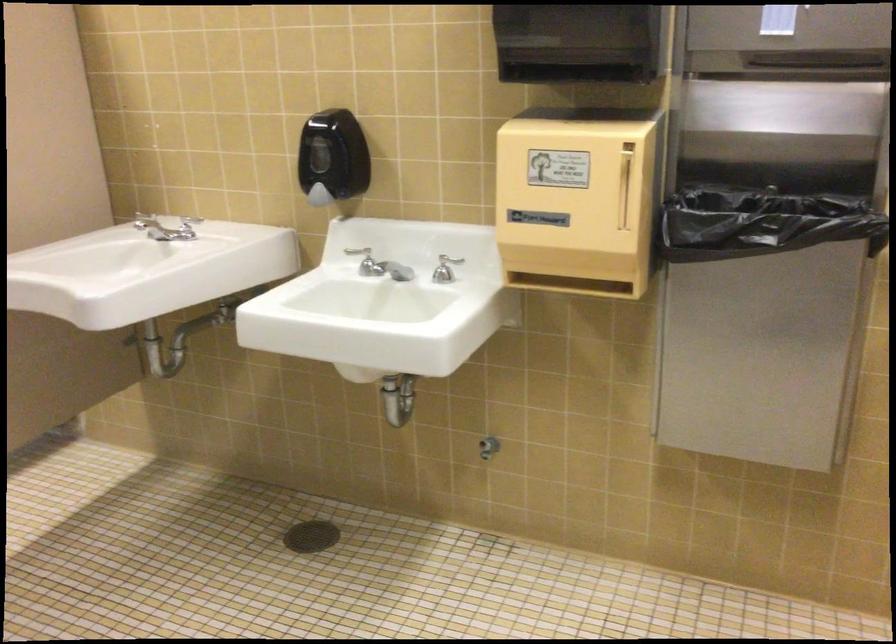
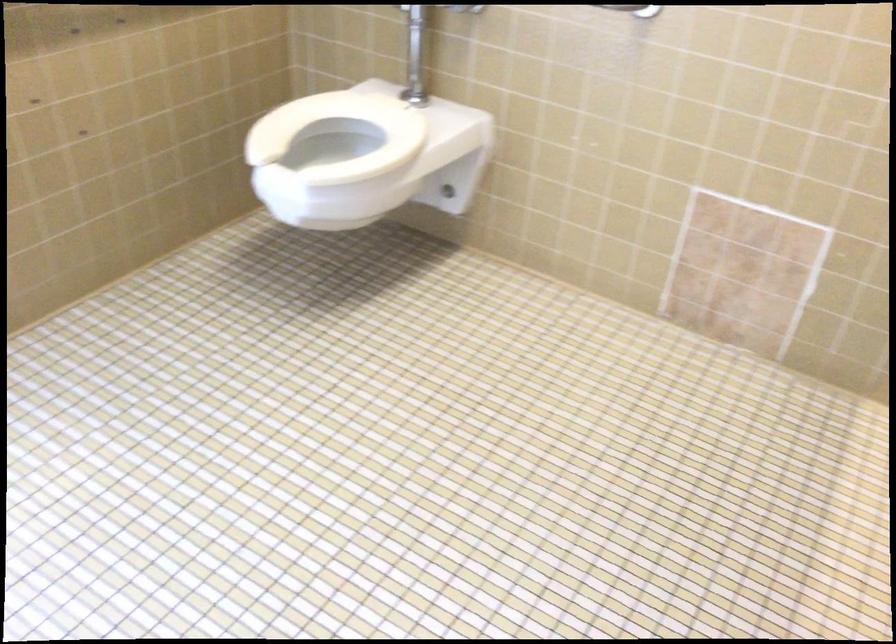
In a continuous first-person perspective shot, in which direction is the camera moving?

The cameraman walked toward left, forward.